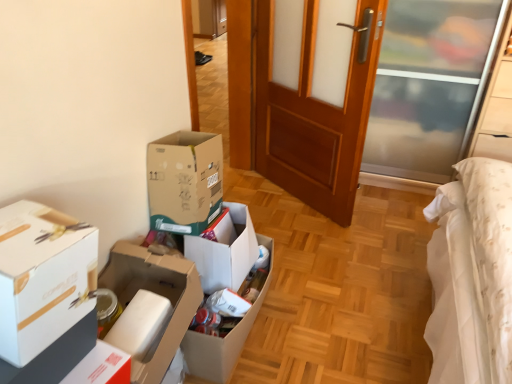
In order to click on vacant area that lies to the right of wooden door at center in this screenshot , I will do `click(387, 212)`.